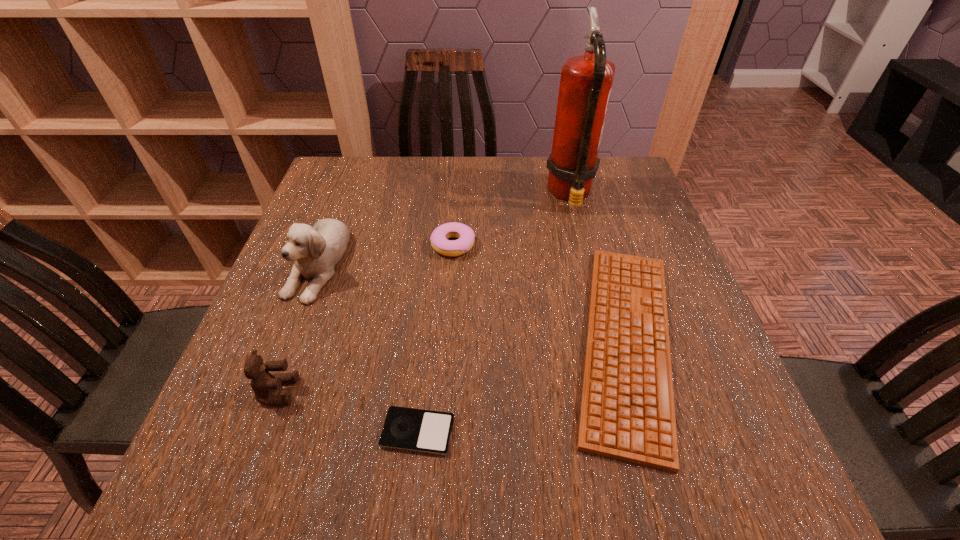
The height and width of the screenshot is (540, 960). What are the coordinates of `object that can be found as the second closest to the doughnut` in the screenshot? It's located at (316, 250).

Identify the location of the closest object to the doughnut. Image resolution: width=960 pixels, height=540 pixels. (627, 413).

Find the location of a particular element. vacant space that satisfies the following two spatial constraints: 1. on the back side of the iPod; 2. on the right side of the third shortest object is located at coordinates (437, 245).

You are a GUI agent. You are given a task and a screenshot of the screen. Output one action in this format:
    pyautogui.click(x=<x>, y=<y>)
    Task: Click on the vacant space that satisfies the following two spatial constraints: 1. on the front side of the third shortest object; 2. on the face of the third tallest object
    The width and height of the screenshot is (960, 540).
    Given the screenshot: What is the action you would take?
    pyautogui.click(x=444, y=392)

At what (x,y) coordinates should I click in order to perform the action: click on free spot that satisfies the following two spatial constraints: 1. on the face of the third tallest object; 2. on the right side of the iPod. Please return your answer as a coordinate pair (x, y). This screenshot has height=540, width=960. Looking at the image, I should click on (263, 432).

Identify the location of vacant position in the image that satisfies the following two spatial constraints: 1. on the front-facing side of the shortest object; 2. on the right side of the second tallest object. This screenshot has height=540, width=960. (252, 432).

Locate an element on the screen. The width and height of the screenshot is (960, 540). free space that satisfies the following two spatial constraints: 1. at the nozzle of the tallest object; 2. on the front side of the iPod is located at coordinates (630, 432).

Identify the location of vacant region that satisfies the following two spatial constraints: 1. at the nozzle of the tallest object; 2. on the front-facing side of the fifth shortest object. Image resolution: width=960 pixels, height=540 pixels. (588, 263).

The height and width of the screenshot is (540, 960). In order to click on free spot that satisfies the following two spatial constraints: 1. on the front-facing side of the fifth shortest object; 2. on the left side of the fifth tallest object in this screenshot , I will do [287, 341].

Find the location of `free spot that satisfies the following two spatial constraints: 1. on the face of the shortest object; 2. on the left side of the teddy bear`. free spot that satisfies the following two spatial constraints: 1. on the face of the shortest object; 2. on the left side of the teddy bear is located at coordinates (263, 432).